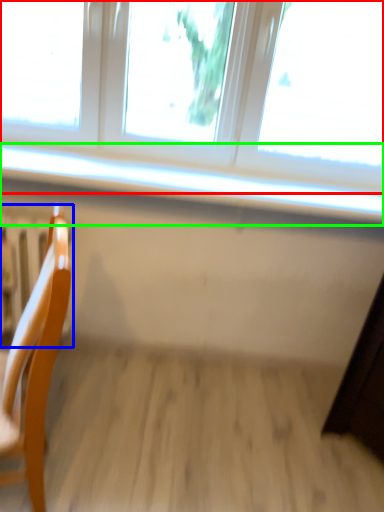
Question: Considering the real-world distances, which object is farthest from window (highlighted by a red box)? radiator (highlighted by a blue box) or window sill (highlighted by a green box)?

Choices:
 (A) radiator
 (B) window sill

Answer: (A)